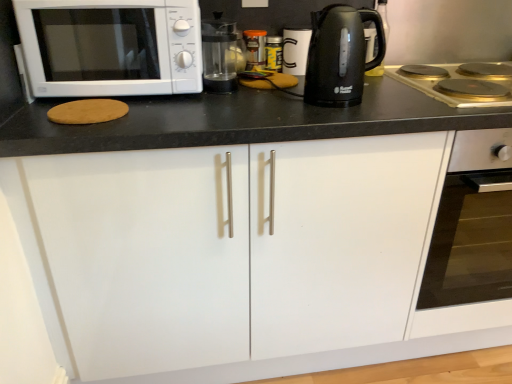
I want to click on vacant region to the left of black glossy electric kettle at upper right, so coord(276,99).